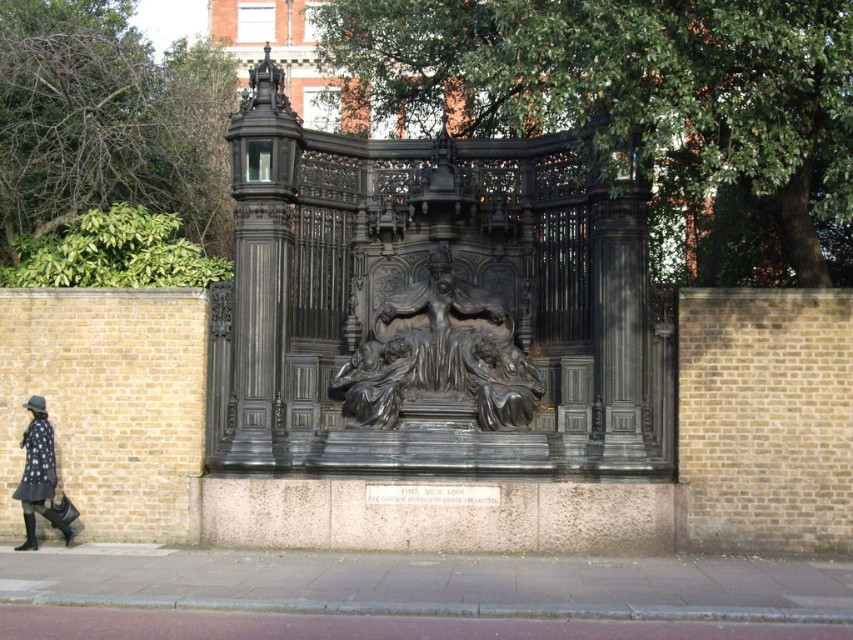
Question: Which object appears closest to the camera in this image?

Choices:
 (A) black polished stone sculpture at center
 (B) polka dot dress at lower left

Answer: (B)

Question: Which point is farther to the camera?

Choices:
 (A) (357, 365)
 (B) (62, 532)

Answer: (A)

Question: Does black polished stone sculpture at center come in front of polka dot dress at lower left?

Choices:
 (A) yes
 (B) no

Answer: (B)

Question: Is black polished stone sculpture at center bigger than polka dot dress at lower left?

Choices:
 (A) no
 (B) yes

Answer: (A)

Question: Can you confirm if black polished stone sculpture at center is positioned to the left of polka dot dress at lower left?

Choices:
 (A) no
 (B) yes

Answer: (A)